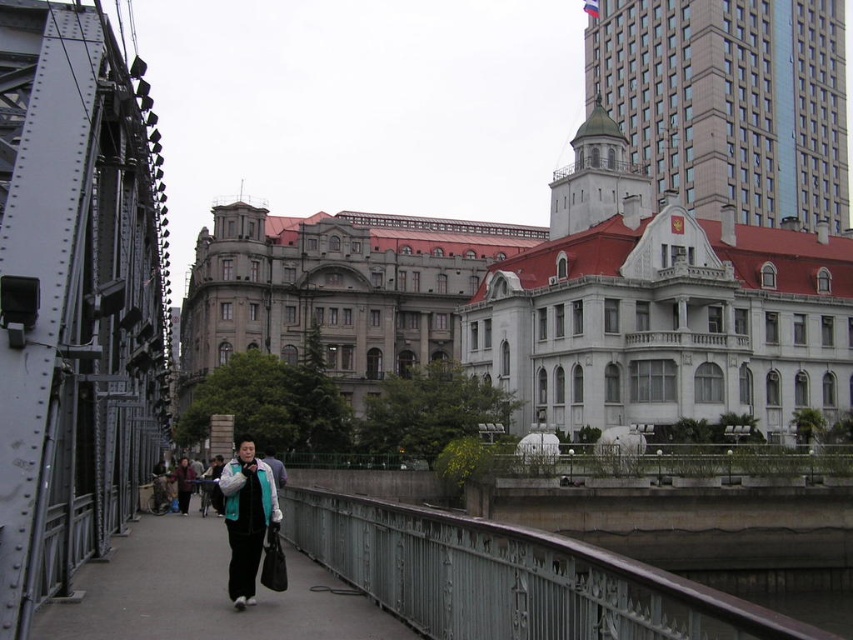
You are a delivery person standing on the bridge and need to place both the black fabric bag at center and the teal fabric jacket at center onto a shelf. The shelf has a height limit of 30 cm. Which item should you place first if you want to ensure both items fit?

The black fabric bag at center has a lesser height compared to the teal fabric jacket at center. Therefore, place the teal fabric jacket at center first to ensure it fits within the 30 cm height limit, then place the black fabric bag at center.

From the picture: You are standing on the metallic gray pedestrian bridge at center and want to hand a leaflet to the person wearing the teal fabric jacket at center. Can you reach them without leaving the bridge?

The metallic gray pedestrian bridge at center is in front of the teal fabric jacket at center, meaning the person is behind the bridge. You cannot reach them while staying on the bridge.